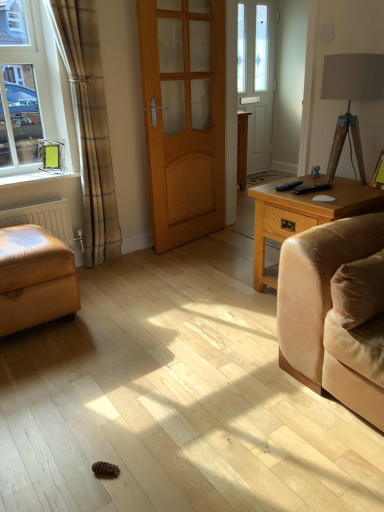
Question: Is matte gray lampshade at upper right not close to white plastic window sill at left?

Choices:
 (A) no
 (B) yes

Answer: (B)

Question: Is matte gray lampshade at upper right aimed at white plastic window sill at left?

Choices:
 (A) yes
 (B) no

Answer: (B)

Question: Is white plastic window sill at left a part of matte gray lampshade at upper right?

Choices:
 (A) yes
 (B) no

Answer: (B)

Question: Can you confirm if matte gray lampshade at upper right is positioned to the left of white plastic window sill at left?

Choices:
 (A) yes
 (B) no

Answer: (B)

Question: Does matte gray lampshade at upper right have a smaller size compared to white plastic window sill at left?

Choices:
 (A) yes
 (B) no

Answer: (B)

Question: Is matte gray lampshade at upper right to the right of white plastic window sill at left from the viewer's perspective?

Choices:
 (A) yes
 (B) no

Answer: (A)

Question: From a real-world perspective, is light brown wooden side table at right physically below wooden door at center?

Choices:
 (A) yes
 (B) no

Answer: (A)

Question: Is light brown wooden side table at right outside of wooden door at center?

Choices:
 (A) yes
 (B) no

Answer: (A)

Question: Does light brown wooden side table at right have a larger size compared to wooden door at center?

Choices:
 (A) yes
 (B) no

Answer: (A)

Question: Is wooden door at center completely or partially inside light brown wooden side table at right?

Choices:
 (A) no
 (B) yes

Answer: (A)

Question: Does light brown wooden side table at right have a lesser height compared to wooden door at center?

Choices:
 (A) yes
 (B) no

Answer: (A)

Question: Is light brown wooden side table at right positioned before wooden door at center?

Choices:
 (A) no
 (B) yes

Answer: (B)

Question: Does suede cushion at right have a lesser width compared to white matte radiator at lower left?

Choices:
 (A) yes
 (B) no

Answer: (B)